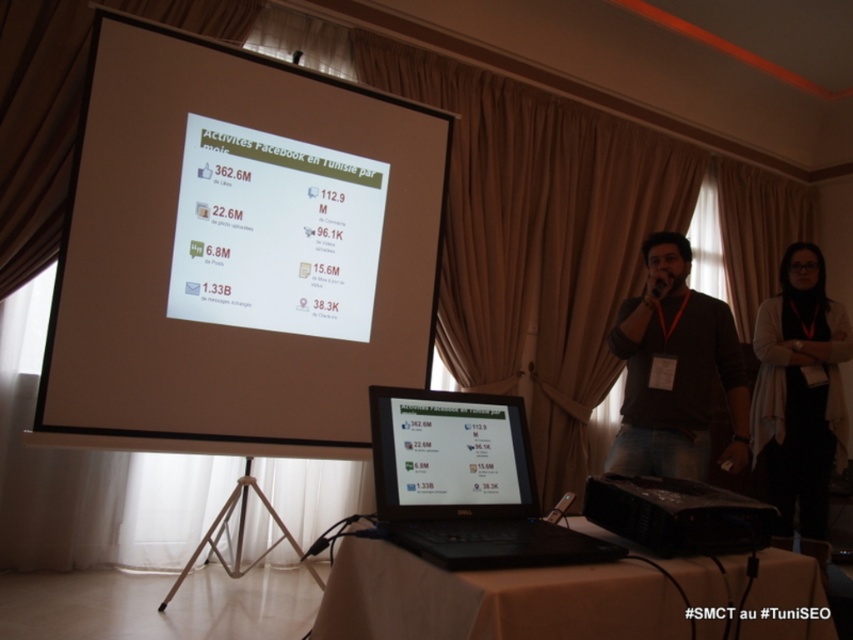
You are an event organizer preparing for a presentation. You have two items on the presenter stand at the front of the room, a brown cotton shirt at center and a black cardigan at center. You need to place a name tag on the larger one. Which item should you choose?

The black cardigan at center is larger than the brown cotton shirt at center, so you should place the name tag on the black cardigan at center.

In the scene shown: You are an event organizer setting up for a presentation. You have two laptops, the black matte laptop at center and the matte black laptop at center, placed on a table. You need to connect a cable to the one that is lower. Which laptop should you connect the cable to?

The black matte laptop at center is positioned under the matte black laptop at center, so you should connect the cable to the black matte laptop at center since it is lower.